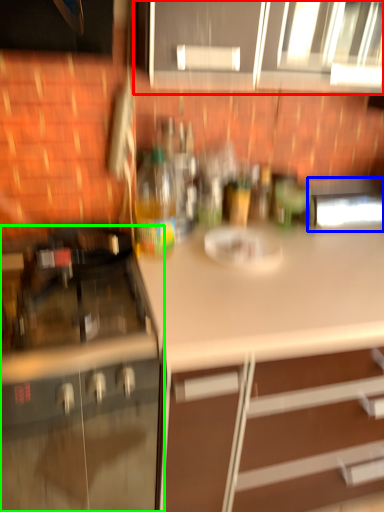
Question: Which is farther away from cabinetry (highlighted by a red box)? appliance (highlighted by a blue box) or cabinetry (highlighted by a green box)?

Choices:
 (A) appliance
 (B) cabinetry

Answer: (B)